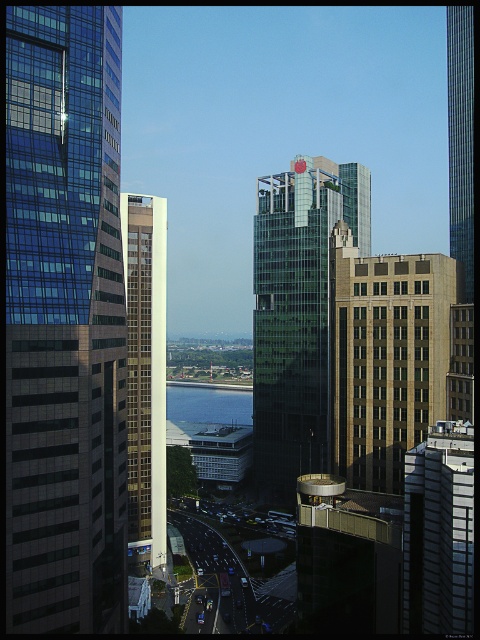
You are a city planner assessing the urban layout. Given the brown brick building at center and the glassy skyscraper at right, which one would require more space for construction based on their sizes?

The glassy skyscraper at right requires more space for construction because it is larger than the brown brick building at center.